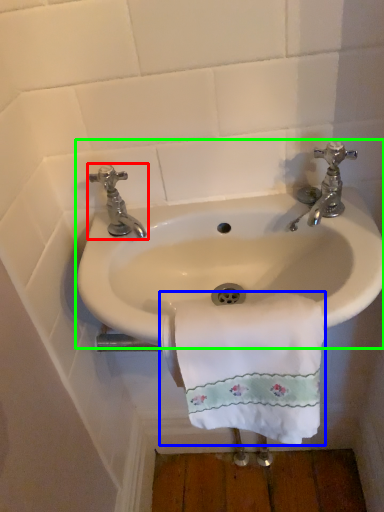
Question: Estimate the real-world distances between objects in this image. Which object is farther from tap (highlighted by a red box), towel/napkin (highlighted by a blue box) or sink (highlighted by a green box)?

Choices:
 (A) towel/napkin
 (B) sink

Answer: (A)